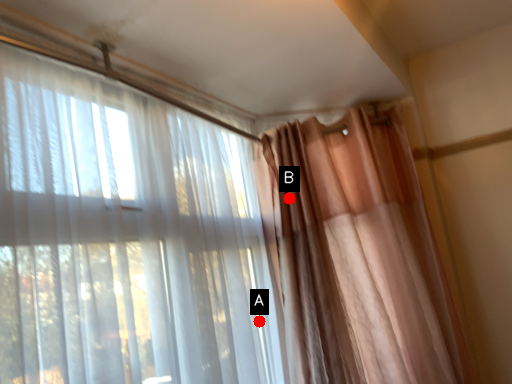
Question: Two points are circled on the image, labeled by A and B beside each circle. Among these points, which one is nearest to the camera?

Choices:
 (A) A is closer
 (B) B is closer

Answer: (A)